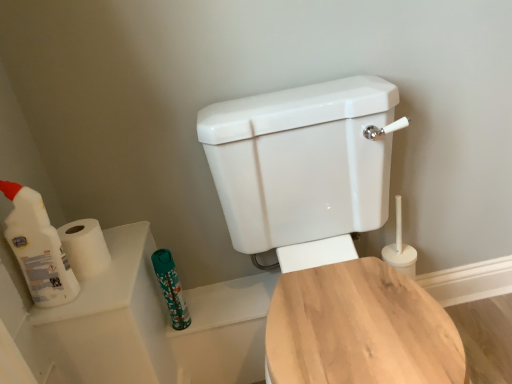
Find the location of `free space to the back side of white matte toilet paper at left`. free space to the back side of white matte toilet paper at left is located at coordinates (124, 234).